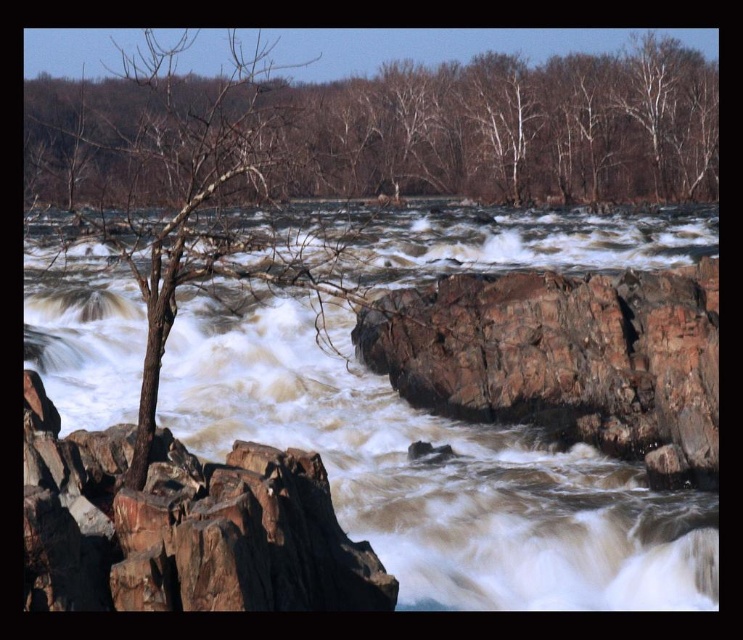
You are a hiker trying to cross the river using the rocks. The brown rough rock at left is your first stepping stone. If you can jump 20 feet, will you be able to reach the next rock?

The distance between the brown rough rock at left and the next rock is 21.22 feet, which is slightly longer than your jumping ability of 20 feet. Therefore, you might not be able to safely make the jump.

You are standing at the point with coordinates point (502, 417) and want to reach the point (322, 545). Considering the rocky terrain and the river, which direction should you move to get closer to your destination?

You should move forward because point (322, 545) is in front of point (502, 417).